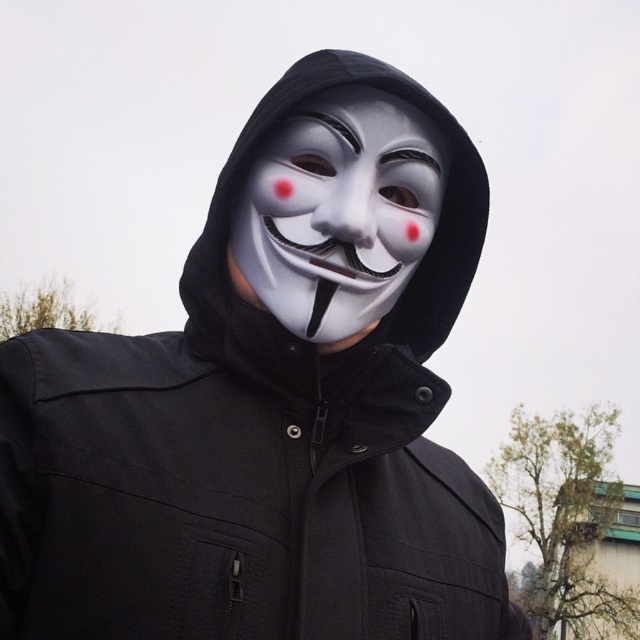
Is point (387, 177) positioned in front of point (323, 170)?

That is False.

Can you confirm if white matte mask at center is wider than white matte/natural nose at center?

Yes, white matte mask at center is wider than white matte/natural nose at center.

Is point (282, 124) closer to viewer compared to point (362, 224)?

No.

This screenshot has width=640, height=640. Identify the location of white matte mask at center. (339, 211).